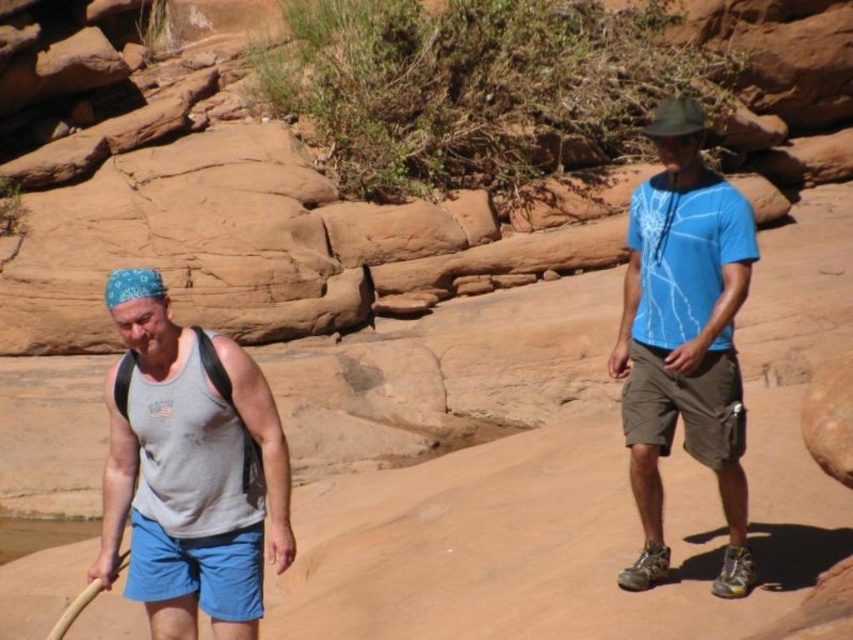
Can you confirm if gray cotton tank top at left is taller than blue matte t-shirt at center?

Incorrect, gray cotton tank top at left's height is not larger of blue matte t-shirt at center's.

Measure the distance between gray cotton tank top at left and blue matte t-shirt at center.

gray cotton tank top at left is 6.36 feet from blue matte t-shirt at center.

Which is behind, point (154, 284) or point (700, 321)?

Point (700, 321)

You are a GUI agent. You are given a task and a screenshot of the screen. Output one action in this format:
    pyautogui.click(x=<x>, y=<y>)
    Task: Click on the gray cotton tank top at left
    This screenshot has width=853, height=640.
    Given the screenshot: What is the action you would take?
    pyautogui.click(x=189, y=472)